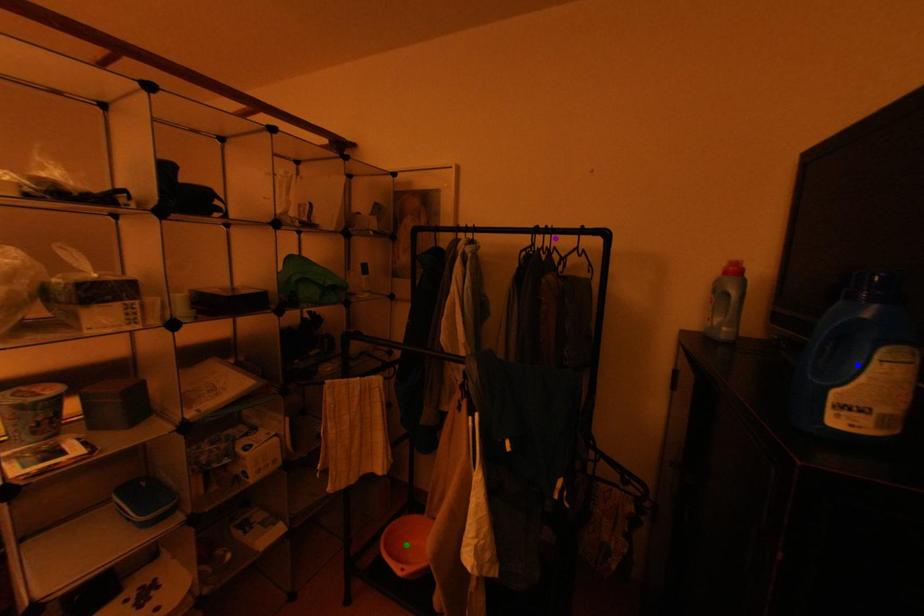
Order these from nearest to farthest:
purple point
green point
blue point

green point < purple point < blue point